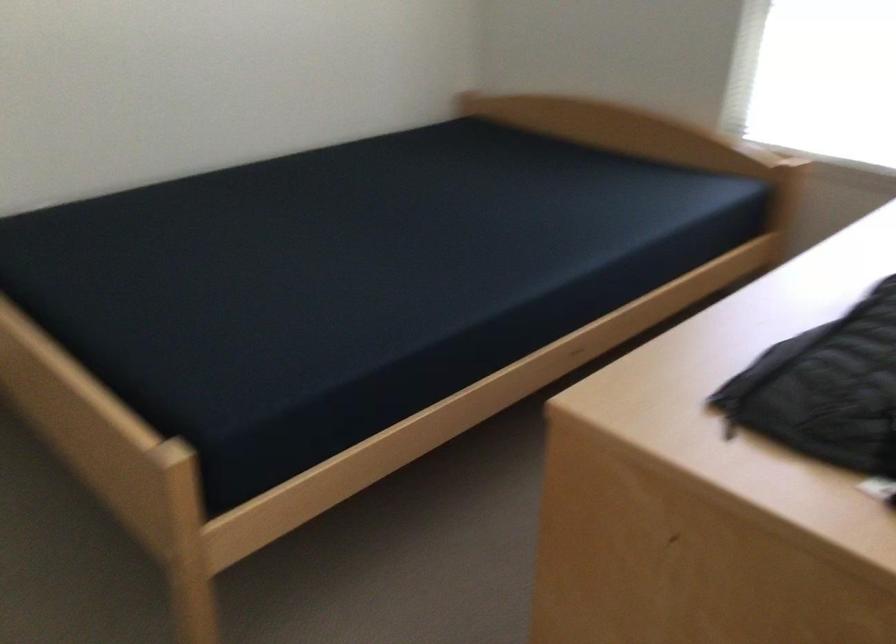
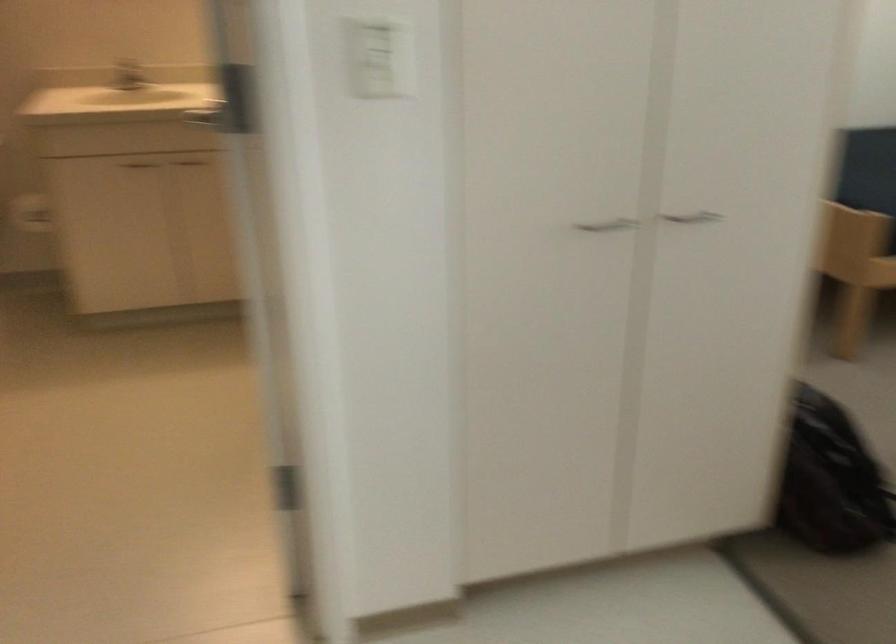
What movement of the cameraman would produce the second image?

The cameraman moved toward left, backward.